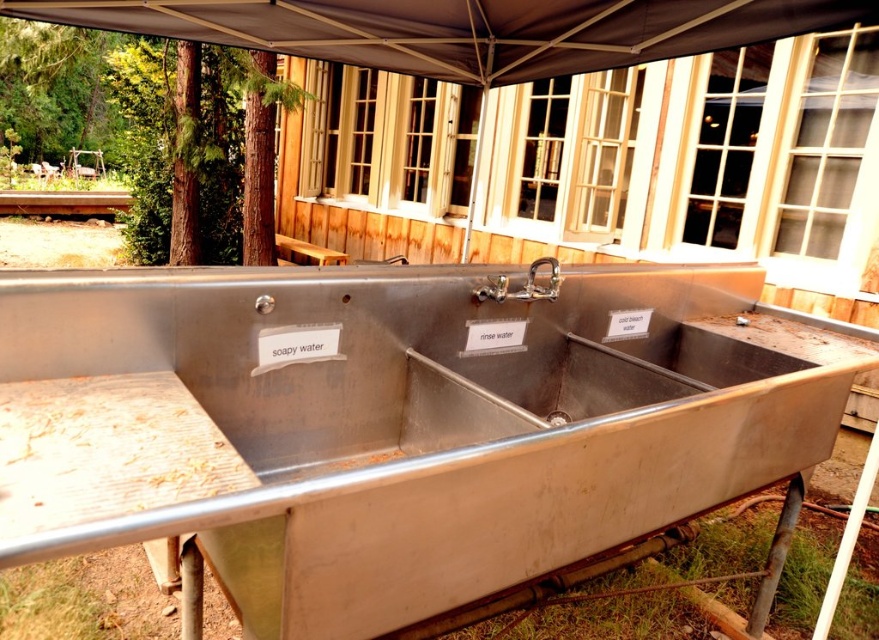
Question: Which of these objects is positioned farthest from the silver metallic faucet at upper center?

Choices:
 (A) brown wooden picnic table at center
 (B) brown fabric canopy at upper center

Answer: (A)

Question: Where is brown fabric canopy at upper center located in relation to brown wooden picnic table at center in the image?

Choices:
 (A) right
 (B) left

Answer: (A)

Question: Where is brown fabric canopy at upper center located in relation to brown wooden picnic table at center in the image?

Choices:
 (A) below
 (B) above

Answer: (B)

Question: Which of the following is the farthest from the observer?

Choices:
 (A) brown fabric canopy at upper center
 (B) brown wooden picnic table at center
 (C) silver metallic faucet at upper center

Answer: (B)

Question: Which point is closer to the camera taking this photo?

Choices:
 (A) (558, 282)
 (B) (321, 248)

Answer: (A)

Question: Does brown fabric canopy at upper center have a larger size compared to silver metallic faucet at upper center?

Choices:
 (A) no
 (B) yes

Answer: (B)